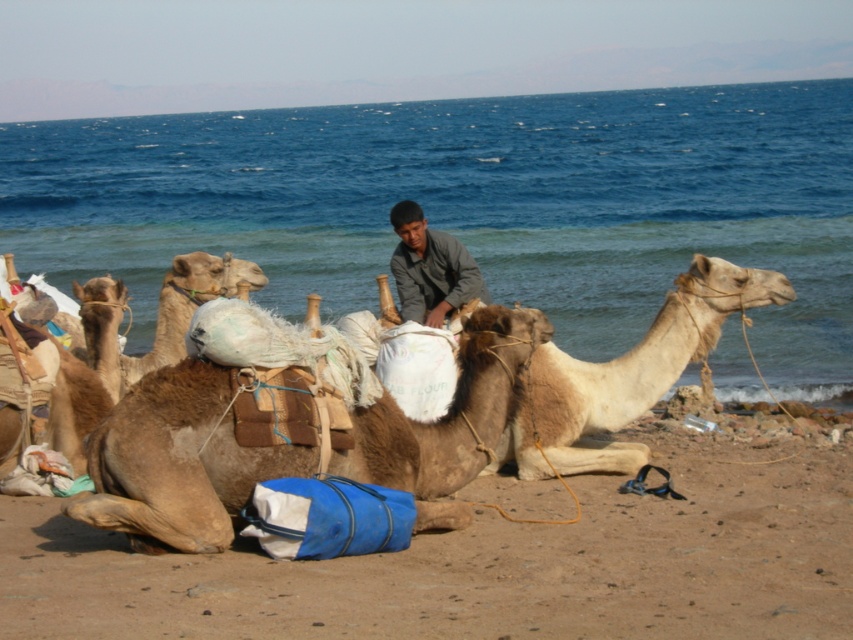
Can you confirm if fuzzy beige camel at center is wider than brown textured camel at center?

Yes.

Can you confirm if fuzzy beige camel at center is positioned to the left of brown textured camel at center?

In fact, fuzzy beige camel at center is to the right of brown textured camel at center.

Between point (718, 317) and point (234, 280), which one is positioned behind?

The point (234, 280) is more distant.

Locate an element on the screen. The image size is (853, 640). fuzzy beige camel at center is located at coordinates [x=625, y=374].

Which is below, brown sandy ground at lower center or fuzzy beige camel at center?

A: Positioned lower is brown sandy ground at lower center.

Is brown sandy ground at lower center in front of fuzzy beige camel at center?

Yes, brown sandy ground at lower center is in front of fuzzy beige camel at center.

Does point (502, 600) lie in front of point (698, 257)?

Yes.

Where is `brown sandy ground at lower center`? This screenshot has width=853, height=640. brown sandy ground at lower center is located at coordinates (489, 563).

How far apart are brown sandy ground at lower center and brown textured camel at center?

A distance of 3.90 meters exists between brown sandy ground at lower center and brown textured camel at center.

Which is more to the right, brown sandy ground at lower center or brown textured camel at center?

brown sandy ground at lower center is more to the right.

Find the location of a particular element. Image resolution: width=853 pixels, height=640 pixels. brown sandy ground at lower center is located at coordinates pos(489,563).